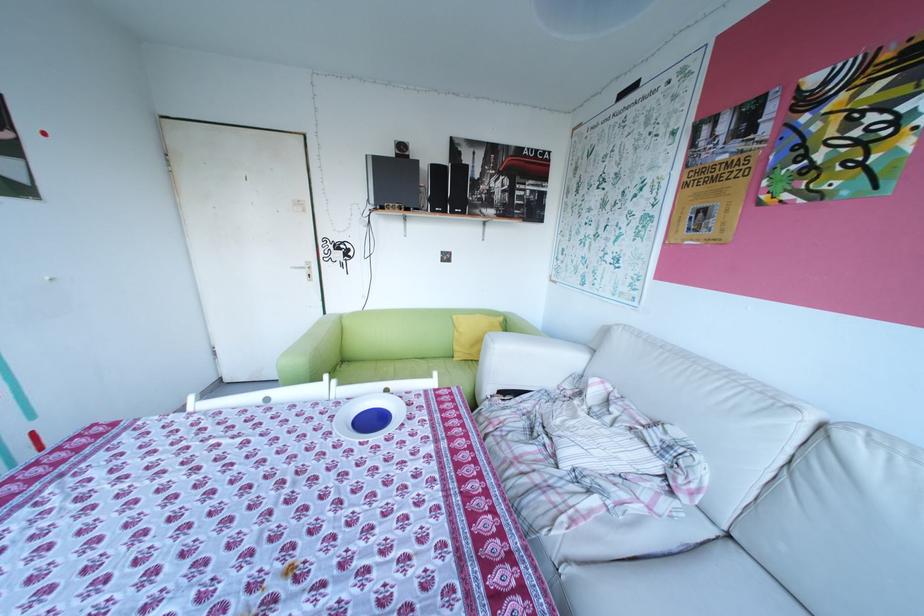
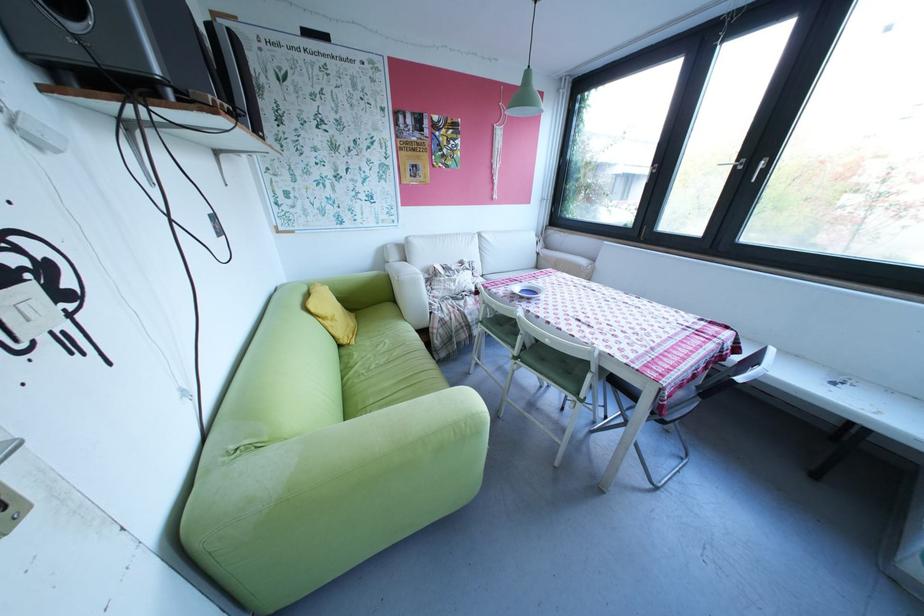
In the second image, find the point that corresponds to (468,334) in the first image.

(339, 323)